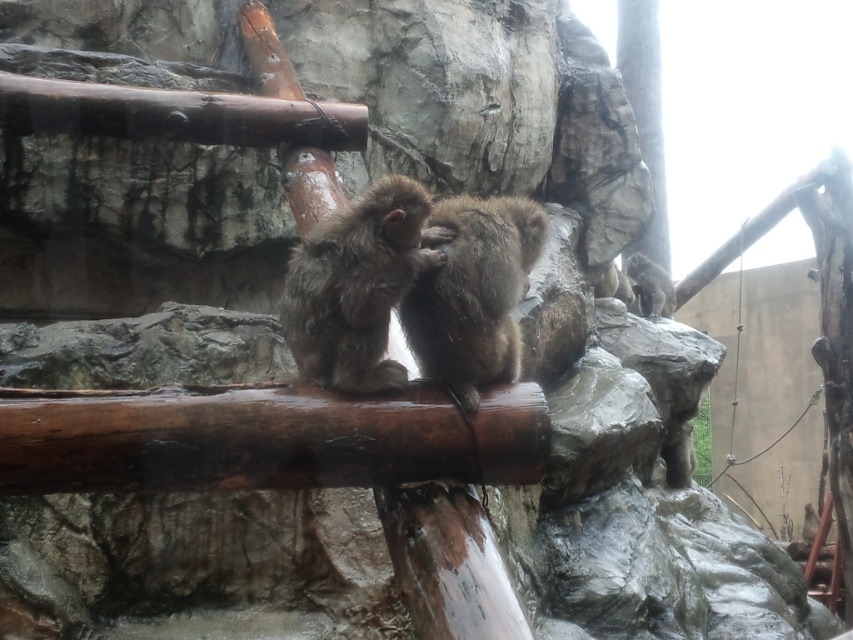
You are a zookeeper observing two monkeys on a rocky surface. The monkeys are positioned at point (409, 202) and point (444, 225). Which monkey is closer to you?

The monkey at point (409, 202) is closer to you than the monkey at point (444, 225).

You are a zookeeper observing the monkeys in their enclosure. You see the brown furry monkey at center and the fuzzy brown monkey at upper right. Which monkey is positioned higher up in the enclosure?

The fuzzy brown monkey at upper right is positioned higher up in the enclosure than the brown furry monkey at center.